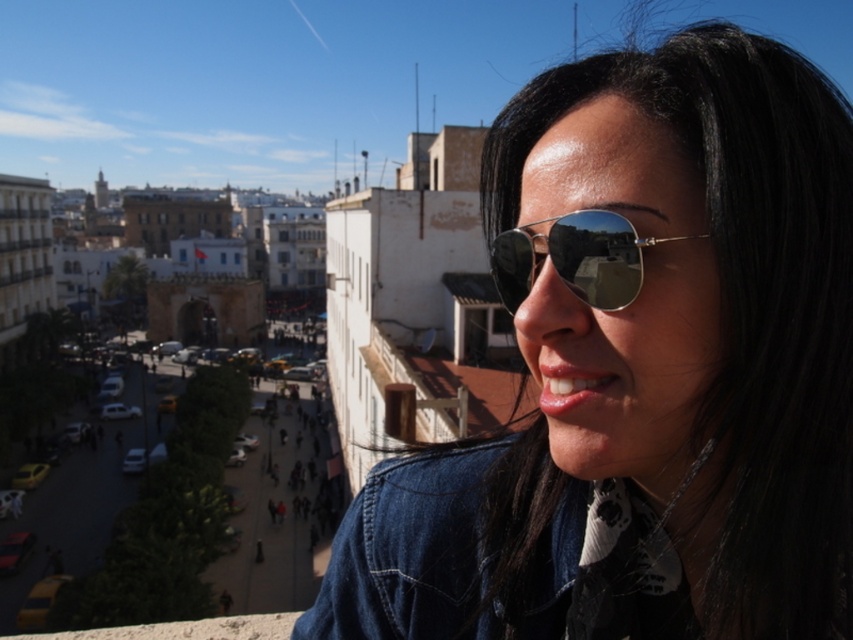
Does matte black sunglasses at upper right have a smaller size compared to silver reflective sunglasses at center?

Incorrect, matte black sunglasses at upper right is not smaller in size than silver reflective sunglasses at center.

Between point (596, 620) and point (535, 243), which one is positioned behind?

The point (535, 243) is behind.

Describe the element at coordinates (643, 371) in the screenshot. The width and height of the screenshot is (853, 640). I see `matte black sunglasses at upper right` at that location.

Where is `matte black sunglasses at upper right`? This screenshot has height=640, width=853. matte black sunglasses at upper right is located at coordinates (643, 371).

Between matte black sunglasses at upper right and denim jacket at lower right, which one appears on the right side from the viewer's perspective?

matte black sunglasses at upper right

Who is lower down, matte black sunglasses at upper right or denim jacket at lower right?

denim jacket at lower right is lower down.

Where is `matte black sunglasses at upper right`? matte black sunglasses at upper right is located at coordinates (643, 371).

The height and width of the screenshot is (640, 853). I want to click on matte black sunglasses at upper right, so click(643, 371).

Describe the element at coordinates (534, 563) in the screenshot. This screenshot has width=853, height=640. I see `denim jacket at lower right` at that location.

The height and width of the screenshot is (640, 853). Identify the location of denim jacket at lower right. (534, 563).